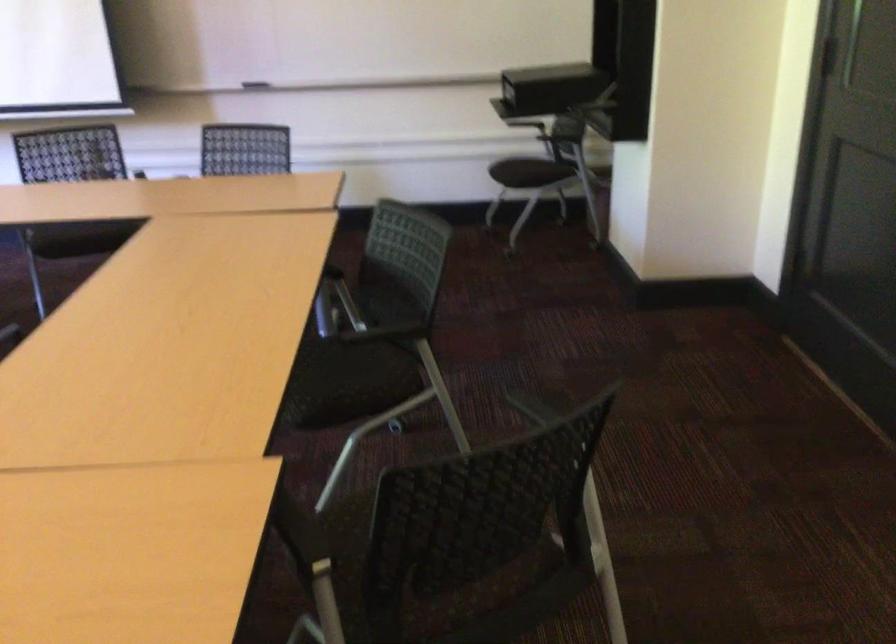
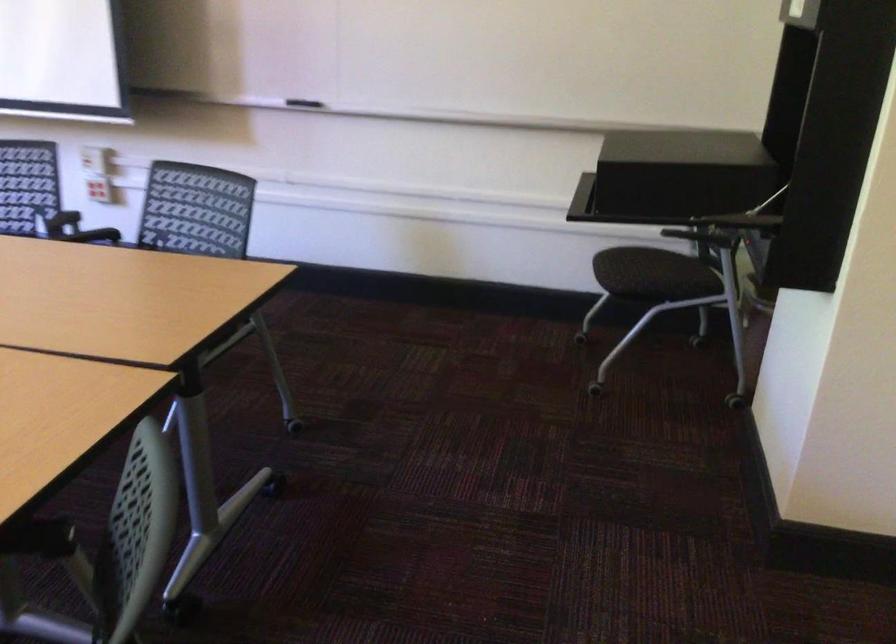
Question: The images are taken continuously from a first-person perspective. In which direction are you moving?

Choices:
 (A) Left
 (B) Right
 (C) Forward
 (D) Backward

Answer: (C)